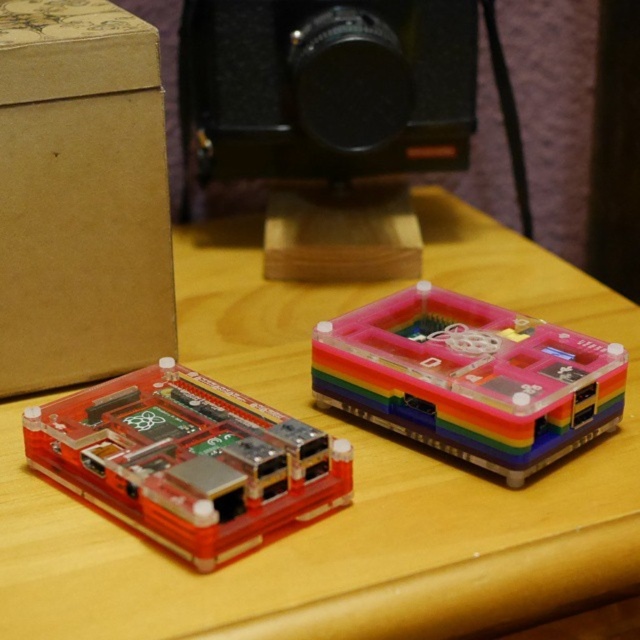
You are setting up a photography studio and need to place a new equipment bag between the brown cardboard box at upper left and the black plastic camera at upper center. Based on their positions, can you determine if there is enough space to place the equipment bag between them?

The brown cardboard box at upper left is to the left of the black plastic camera at upper center, so there is space between them to place the equipment bag.

You are setting up a photography setup and need to place a Raspberry Pi on a wooden surface. You have a transparent plastic Raspberry Pi at left and another Raspberry Pi with a rainbow shell on the right. According to the image, which Raspberry Pi is positioned closer to the left edge of the wooden surface?

The transparent plastic Raspberry Pi at left is positioned closer to the left edge of the wooden surface as it is located at point (188, 460), which places it nearer to the left side compared to the rainbow shell Raspberry Pi on the right.